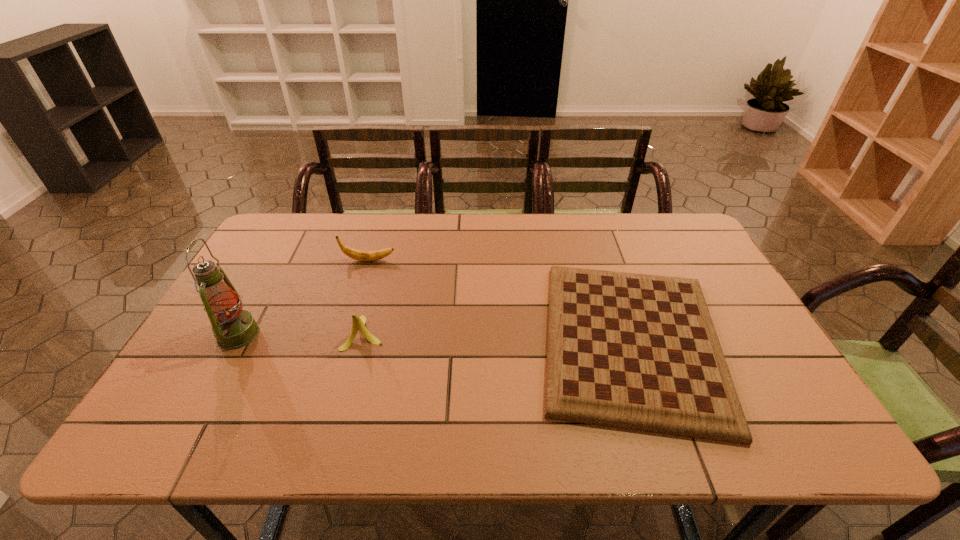
At what (x,y) coordinates should I click in order to perform the action: click on free location that satisfies the following two spatial constraints: 1. on the peel of the farther banana from the top; 2. on the right side of the nearer banana. Please return your answer as a coordinate pair (x, y). Image resolution: width=960 pixels, height=540 pixels. Looking at the image, I should click on (347, 333).

What are the coordinates of `free space that satisfies the following two spatial constraints: 1. on the peel of the nearer banana from the top; 2. on the left side of the farther banana` in the screenshot? It's located at (347, 333).

Find the location of a particular element. This screenshot has height=540, width=960. vacant space that satisfies the following two spatial constraints: 1. on the front side of the leftmost object; 2. on the right side of the rightmost object is located at coordinates (234, 341).

Identify the location of vacant area that satisfies the following two spatial constraints: 1. on the peel of the farthest object from the top; 2. on the back side of the shortest object. (344, 341).